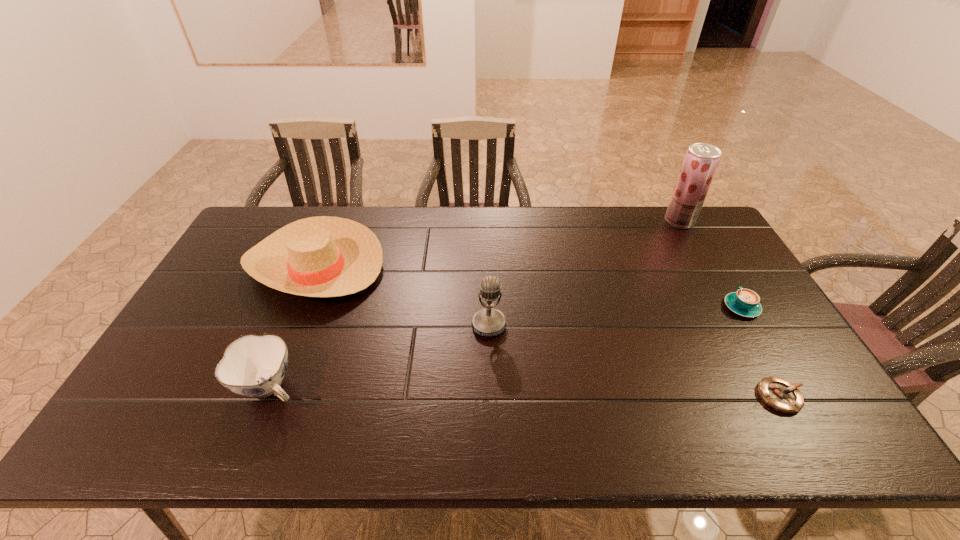
The height and width of the screenshot is (540, 960). Find the location of `vacant space that satisfies the following two spatial constraints: 1. on the front side of the chinaware; 2. on the right side of the shortest object`. vacant space that satisfies the following two spatial constraints: 1. on the front side of the chinaware; 2. on the right side of the shortest object is located at coordinates (266, 396).

Locate an element on the screen. The width and height of the screenshot is (960, 540). free space that satisfies the following two spatial constraints: 1. on the front side of the tallest object; 2. on the left side of the shortest object is located at coordinates (778, 396).

Identify the location of vacant space that satisfies the following two spatial constraints: 1. on the back side of the sunhat; 2. on the left side of the tallest object. This screenshot has height=540, width=960. (333, 221).

The width and height of the screenshot is (960, 540). What are the coordinates of `vacant area that satisfies the following two spatial constraints: 1. on the front side of the sunhat; 2. on the left side of the chinaware` in the screenshot? It's located at (266, 387).